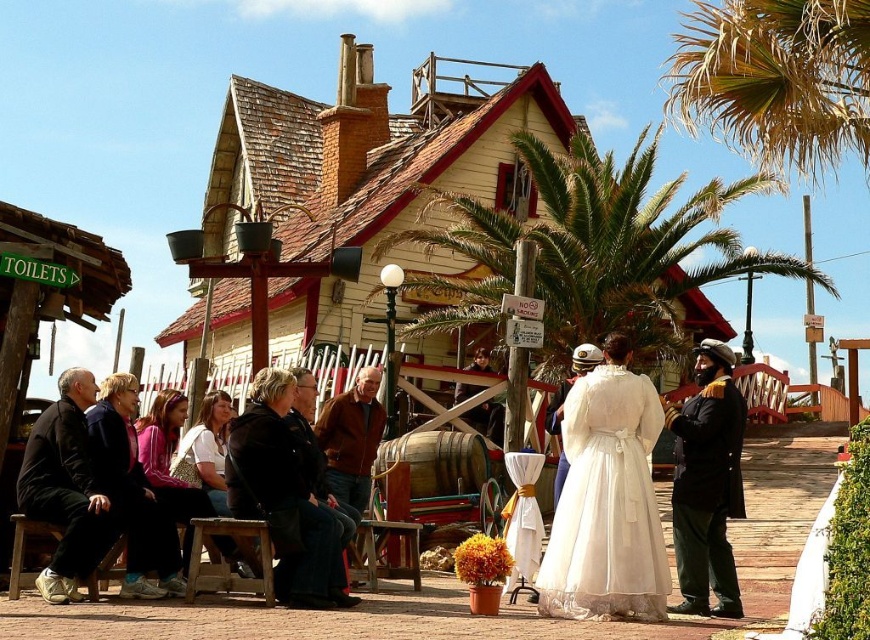
You are a photographer planning to take a group photo of the people in the scene. You need to arrange everyone so that the white satin dress at center and the white fur coat at center are visible. Given their widths, which clothing item should be placed closer to the camera to ensure both are fully visible?

The white satin dress at center is wider than the white fur coat at center. To ensure both are fully visible in the photo, the white satin dress at center should be placed closer to the camera since its greater width requires more space in the frame.

From the picture: You are standing in the park and want to take a photo of the white satin dress at center. Where should you position yourself to capture it in the frame?

To capture the white satin dress at center in the frame, position yourself facing the dress, which is located at coordinates approximately 0.789 on the x and 0.698 on the y axis.

You are a visitor in this historical park and you want to find the black leather jacket at center. According to the map coordinates, where should you look?

The black leather jacket at center is located at point (284, 497).